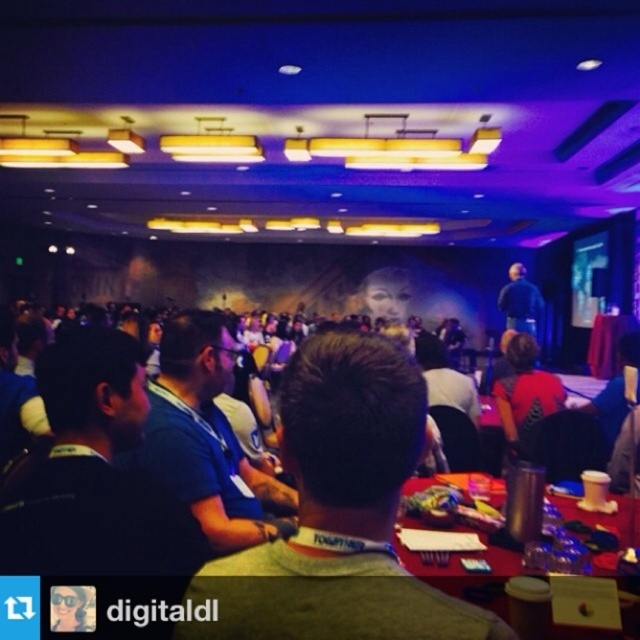
You are an attendee at this event and want to get a drink from the table closest to you. The red plastic table at lower right and the dark blue shirt at center are in your line of sight. Which object is closer to you?

The red plastic table at lower right is closer to you because it is in front of the dark blue shirt at center, meaning it is positioned nearer in your line of sight.

You are a photographer standing at the center of the room. You want to take a photo of the white fabric lanyard at center and the red plastic table at lower right. Can you fit both in your camera frame if your camera has a maximum horizontal field of view of 36 inches?

The distance between the white fabric lanyard at center and the red plastic table at lower right is 36.23 inches, which is slightly wider than the camera frame of 36 inches. Therefore, you cannot fit both objects in the frame at the same time.